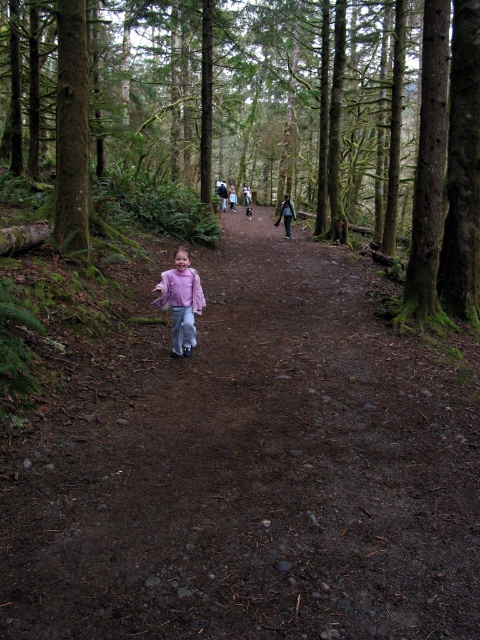
Question: Estimate the real-world distances between objects in this image. Which object is closer to the matte pink jacket at center?

Choices:
 (A) brown dirt path at center
 (B) green mossy tree at center
 (C) matte pink shirt at center

Answer: (C)

Question: Is green mossy tree at center to the right of matte pink shirt at center from the viewer's perspective?

Choices:
 (A) no
 (B) yes

Answer: (A)

Question: Is green mossy tree at center below matte pink jacket at center?

Choices:
 (A) yes
 (B) no

Answer: (B)

Question: Which point is closer to the camera?

Choices:
 (A) (183, 296)
 (B) (252, 236)
 (C) (41, 120)

Answer: (A)

Question: Which of these objects is positioned farthest from the matte pink jacket at center?

Choices:
 (A) matte pink shirt at center
 (B) green mossy tree at center

Answer: (B)

Question: Does green mossy tree at center lie behind matte pink jacket at center?

Choices:
 (A) no
 (B) yes

Answer: (B)